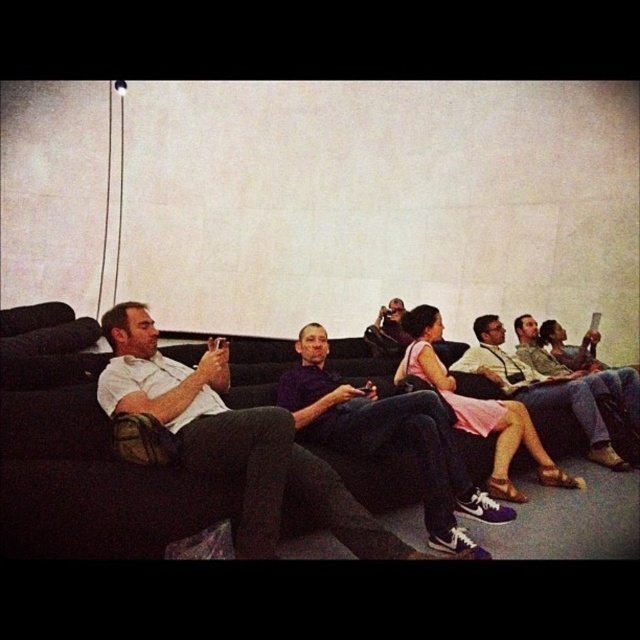
Question: Which object appears closest to the camera in this image?

Choices:
 (A) matte white shirt at center
 (B) white matte shirt at left

Answer: (B)

Question: Does purple matte shirt at center appear on the left side of matte white shirt at center?

Choices:
 (A) no
 (B) yes

Answer: (B)

Question: Considering the real-world distances, which object is closest to the purple matte shirt at center?

Choices:
 (A) matte white shirt at center
 (B) white matte shirt at left

Answer: (B)

Question: Does purple matte shirt at center appear on the right side of matte white shirt at center?

Choices:
 (A) yes
 (B) no

Answer: (B)

Question: Is white matte shirt at left below matte white shirt at center?

Choices:
 (A) no
 (B) yes

Answer: (B)

Question: Estimate the real-world distances between objects in this image. Which object is closer to the white matte shirt at left?

Choices:
 (A) matte white shirt at center
 (B) purple matte shirt at center

Answer: (B)